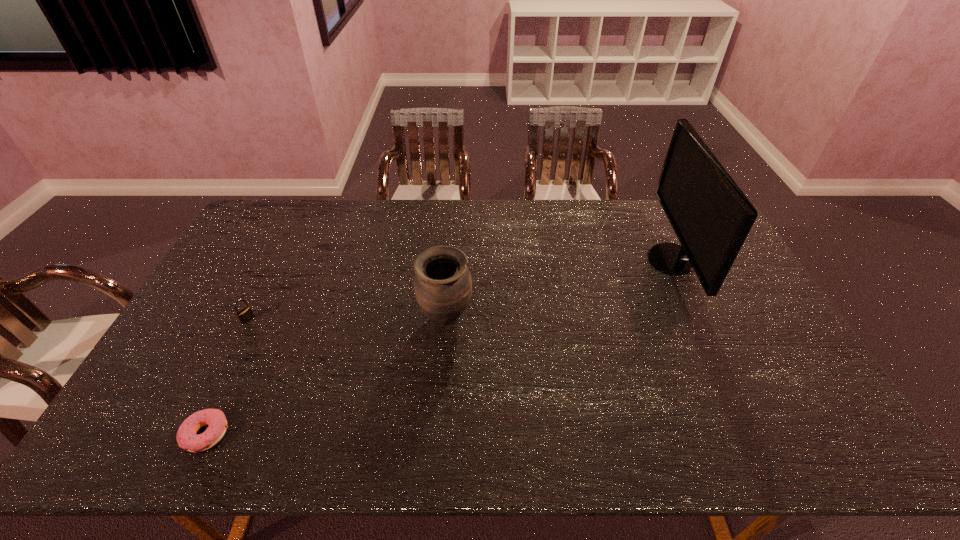
You are a GUI agent. You are given a task and a screenshot of the screen. Output one action in this format:
    pyautogui.click(x=<x>, y=<y>)
    Task: Click on the free space located on the front of the urn
    
    Given the screenshot: What is the action you would take?
    pyautogui.click(x=441, y=393)

Find the location of a particular element. vacant region located on the left of the third tallest object is located at coordinates (188, 320).

The width and height of the screenshot is (960, 540). In order to click on vacant space located 0.400m on the right of the doughnut in this screenshot , I will do `click(397, 434)`.

Locate an element on the screen. This screenshot has width=960, height=540. object that is at the far edge is located at coordinates (711, 216).

The image size is (960, 540). Find the location of `object that is at the near edge`. object that is at the near edge is located at coordinates (187, 438).

Identify the location of padlock that is at the left edge. Image resolution: width=960 pixels, height=540 pixels. (246, 314).

Find the location of a particular element. doughnut at the left edge is located at coordinates (187, 438).

In order to click on object that is positioned at the right edge in this screenshot , I will do `click(711, 216)`.

I want to click on object present at the near left corner, so click(187, 438).

Identify the location of object situated at the far right corner. (711, 216).